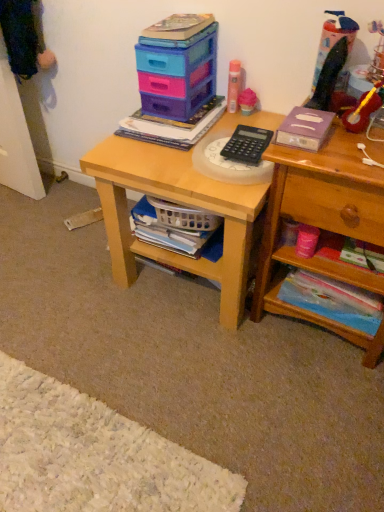
Question: Does translucent plastic toy at upper right, the 3th toy from the left, have a lesser width compared to light wood desk at center?

Choices:
 (A) no
 (B) yes

Answer: (B)

Question: Does translucent plastic toy at upper right, the 3th toy from the left, come behind light wood desk at center?

Choices:
 (A) yes
 (B) no

Answer: (B)

Question: From a real-world perspective, does translucent plastic toy at upper right, the 2th toy in the right-to-left sequence, sit lower than light wood desk at center?

Choices:
 (A) yes
 (B) no

Answer: (B)

Question: Can you confirm if translucent plastic toy at upper right, the 2th toy in the right-to-left sequence, is positioned to the right of light wood desk at center?

Choices:
 (A) no
 (B) yes

Answer: (B)

Question: Considering the relative sizes of translucent plastic toy at upper right, the 3th toy from the left, and light wood desk at center in the image provided, is translucent plastic toy at upper right, the 3th toy from the left, taller than light wood desk at center?

Choices:
 (A) yes
 (B) no

Answer: (B)

Question: From a real-world perspective, is translucent plastic toy at upper right, the 3th toy from the left, physically above light wood desk at center?

Choices:
 (A) yes
 (B) no

Answer: (A)

Question: Is pink matte spray can at upper center, positioned as the first toy in left-to-right order, touching white plastic basket at lower center, acting as the third book starting from the top?

Choices:
 (A) yes
 (B) no

Answer: (B)

Question: From a real-world perspective, is pink matte spray can at upper center, positioned as the first toy in left-to-right order, positioned under white plastic basket at lower center, which ranks as the second book in bottom-to-top order, based on gravity?

Choices:
 (A) yes
 (B) no

Answer: (B)

Question: Does pink matte spray can at upper center, positioned as the 4th toy in right-to-left order, have a smaller size compared to white plastic basket at lower center, acting as the third book starting from the top?

Choices:
 (A) yes
 (B) no

Answer: (A)

Question: Considering the relative sizes of pink matte spray can at upper center, positioned as the first toy in left-to-right order, and white plastic basket at lower center, acting as the third book starting from the top, in the image provided, is pink matte spray can at upper center, positioned as the first toy in left-to-right order, shorter than white plastic basket at lower center, acting as the third book starting from the top,?

Choices:
 (A) no
 (B) yes

Answer: (A)

Question: Are pink matte spray can at upper center, positioned as the 4th toy in right-to-left order, and white plastic basket at lower center, acting as the third book starting from the top, far apart?

Choices:
 (A) no
 (B) yes

Answer: (A)

Question: Is pink matte spray can at upper center, positioned as the first toy in left-to-right order, turned away from white plastic basket at lower center, which ranks as the second book in bottom-to-top order?

Choices:
 (A) yes
 (B) no

Answer: (B)

Question: Can you confirm if purple matte book at upper right, which is the 3th book from bottom to top, is smaller than white plastic basket at lower center, which ranks as the second book in bottom-to-top order?

Choices:
 (A) yes
 (B) no

Answer: (A)